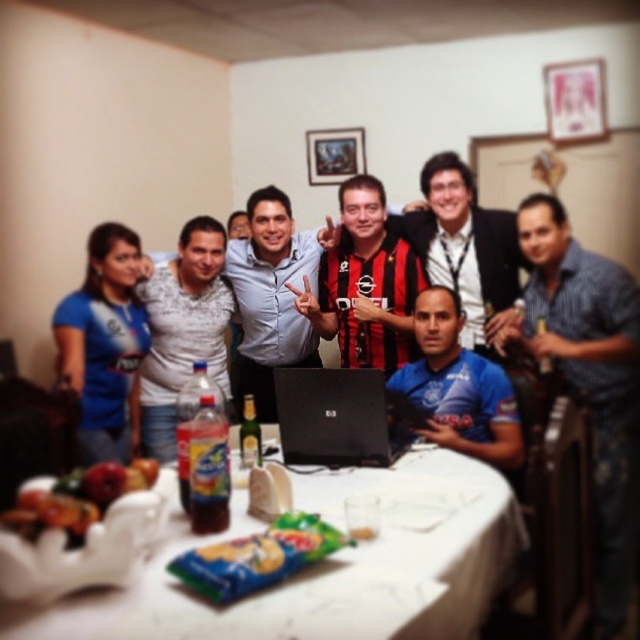
Question: Which object is positioned farthest from the black and red striped jersey at center?

Choices:
 (A) shiny plastic bowl at lower left
 (B) black plastic laptop at center
 (C) white matte shirt at center

Answer: (A)

Question: Is blue striped shirt at right above black and red striped jersey at center?

Choices:
 (A) yes
 (B) no

Answer: (B)

Question: Is matte blue shirt at center wider than black jersey at center?

Choices:
 (A) no
 (B) yes

Answer: (A)

Question: Which object is positioned farthest from the white plastic table at center?

Choices:
 (A) wooden picture frame at upper center
 (B) shiny plastic bowl at lower left
 (C) black jersey at center
 (D) blue jersey at center

Answer: (A)

Question: Which point appears closest to the camera in this image?

Choices:
 (A) (358, 138)
 (B) (77, 520)
 (C) (342, 208)

Answer: (B)

Question: Can you confirm if white plastic table at center is positioned to the right of wooden picture frame at upper center?

Choices:
 (A) no
 (B) yes

Answer: (A)